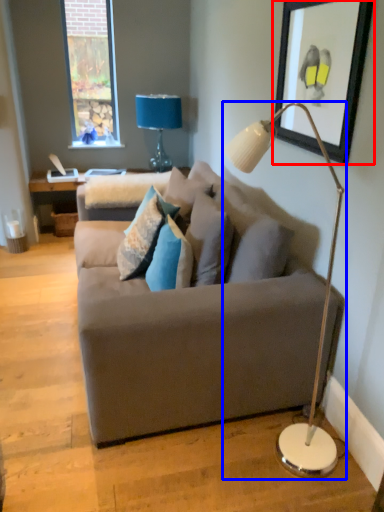
Question: Which object appears closest to the camera in this image, picture frame (highlighted by a red box) or lamp (highlighted by a blue box)?

Choices:
 (A) picture frame
 (B) lamp

Answer: (B)